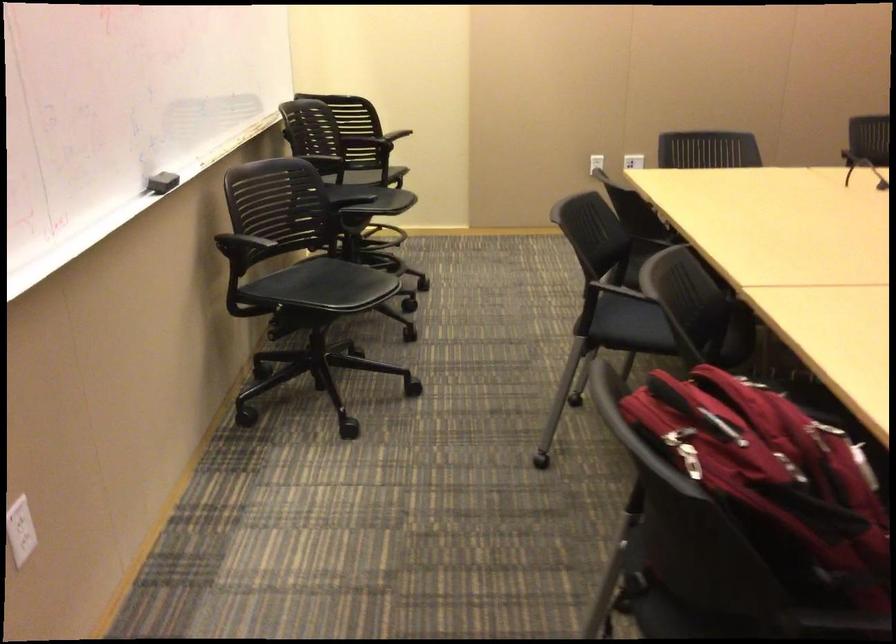
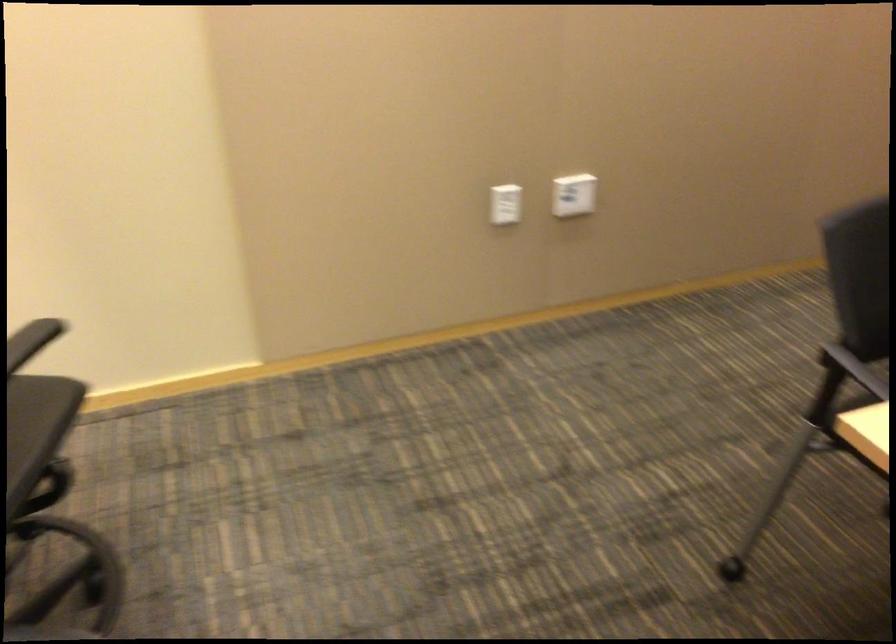
Question: What movement of the cameraman would produce the second image?

Choices:
 (A) Left
 (B) Right
 (C) Forward
 (D) Backward

Answer: (C)